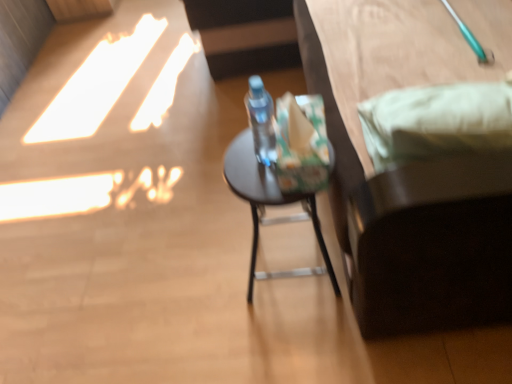
Locate an element on the screen. Image resolution: width=512 pixels, height=384 pixels. vacant space situated on the left part of transparent plastic bottle at center is located at coordinates (241, 162).